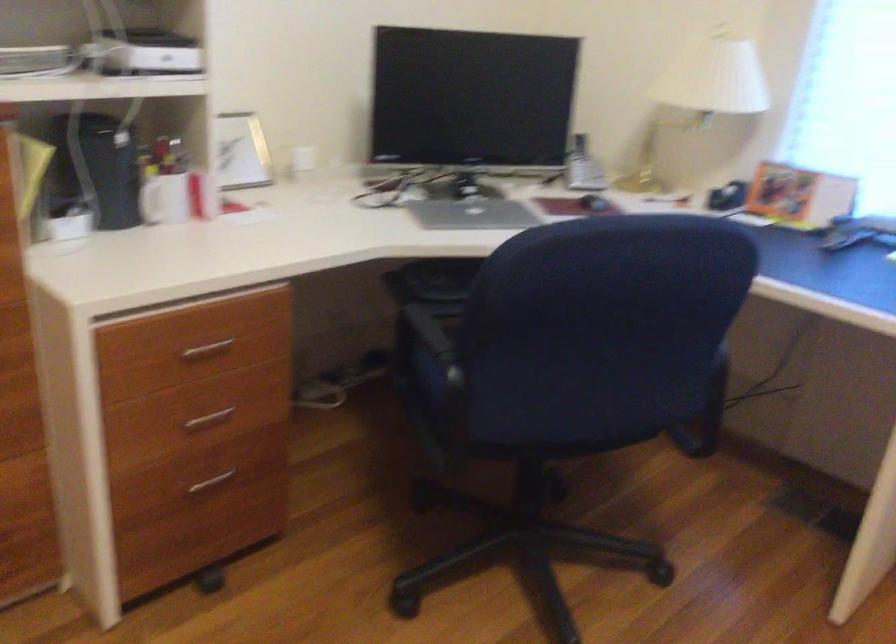
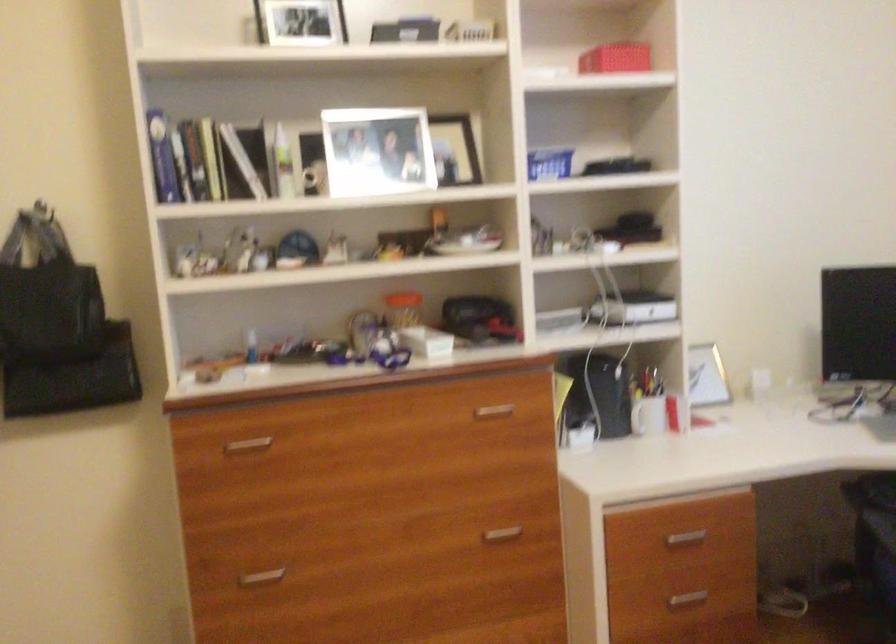
Where in the second image is the point corresponding to point (161, 200) from the first image?

(649, 415)